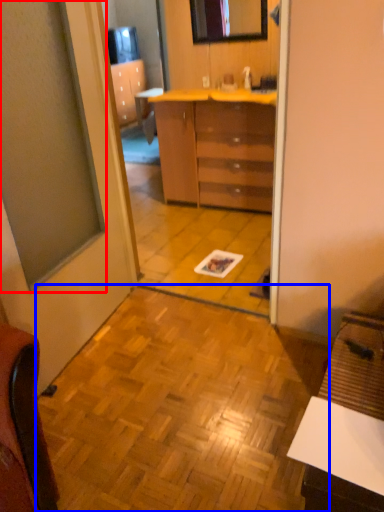
Question: Among these objects, which one is farthest to the camera, window (highlighted by a red box) or tile (highlighted by a blue box)?

Choices:
 (A) window
 (B) tile

Answer: (B)